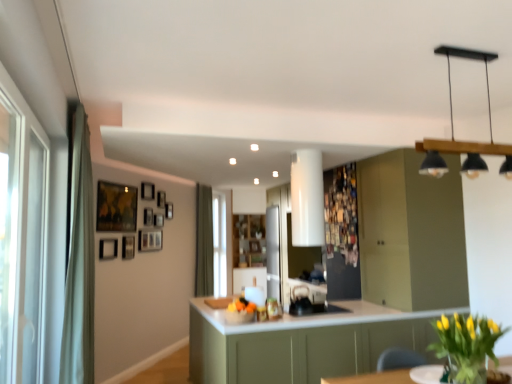
Question: Is point (429, 382) closer or farther from the camera than point (148, 230)?

Choices:
 (A) farther
 (B) closer

Answer: (B)

Question: In the image, is white glossy round table at lower right positioned in front of or behind wooden picture frame at upper center, positioned as the fourth picture frame in front-to-back order?

Choices:
 (A) behind
 (B) front

Answer: (B)

Question: Which object is the closest to the wooden picture frame at upper left, the 4th picture frame viewed from the back?

Choices:
 (A) wooden picture frame at upper center, the 2th picture frame when ordered from back to front
 (B) wooden framed map at upper left, the ninth picture frame in the back-to-front sequence
 (C) black matte light fixture at upper right
 (D) wooden picture frame at center, positioned as the seventh picture frame in front-to-back order
 (E) matte black picture frame at upper left, arranged as the second picture frame when viewed from the front

Answer: (D)

Question: Based on their relative distances, which object is nearer to the yellow-green leafy plant at lower right?

Choices:
 (A) wooden picture frame at upper center, the 2th picture frame when ordered from back to front
 (B) green fabric curtain at left, arranged as the 1th curtain when viewed from the left
 (C) wooden picture frame at upper center, which is the 6th picture frame from back to front
 (D) white glossy round table at lower right
 (E) wooden picture frame at upper left, marked as the 1th picture frame in a back-to-front arrangement

Answer: (D)